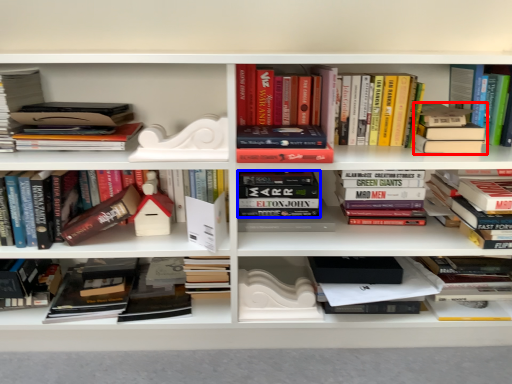
Question: Among these objects, which one is nearest to the camera, book (highlighted by a red box) or book (highlighted by a blue box)?

Choices:
 (A) book
 (B) book

Answer: (A)